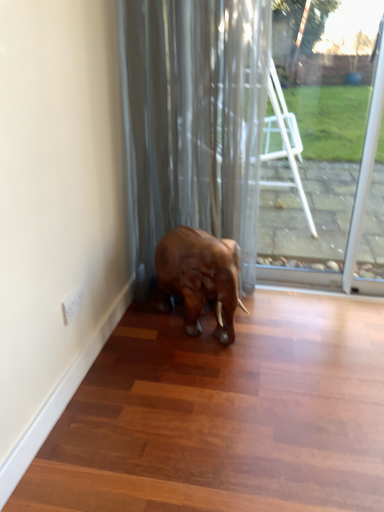
Question: From the image's perspective, relative to transparent glass door at center, is shiny brown elephant at center above or below?

Choices:
 (A) below
 (B) above

Answer: (A)

Question: Is shiny brown elephant at center taller or shorter than transparent glass door at center?

Choices:
 (A) short
 (B) tall

Answer: (A)

Question: Which object is positioned farthest from the transparent glass door at center?

Choices:
 (A) shiny brown elephant at center
 (B) satin gray curtain at center

Answer: (A)

Question: Which object is the farthest from the transparent glass door at center?

Choices:
 (A) shiny brown elephant at center
 (B) satin gray curtain at center

Answer: (A)